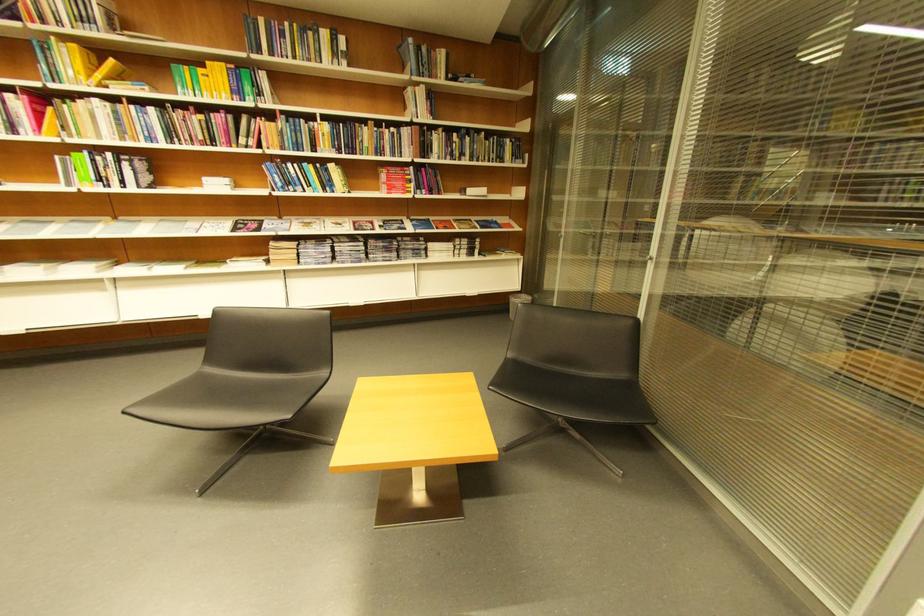
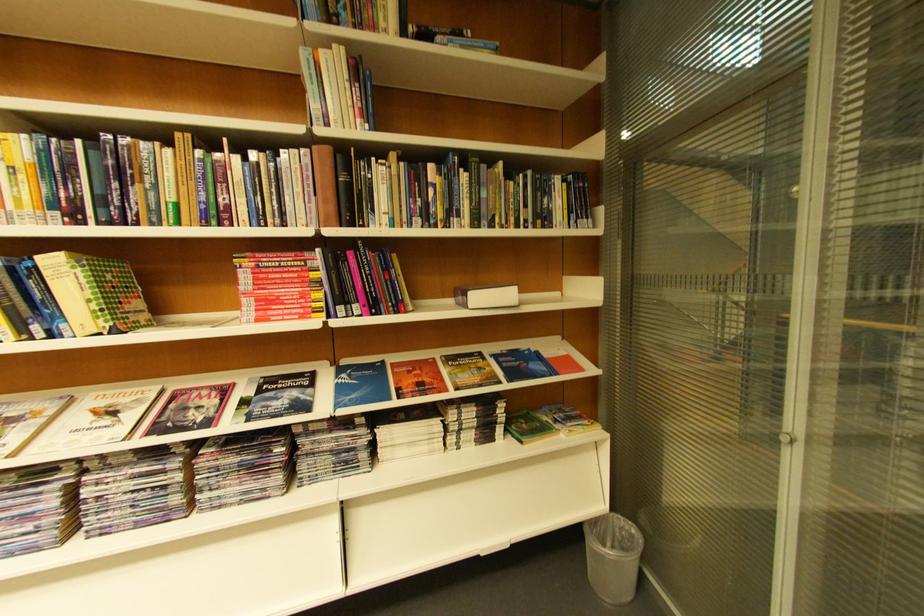
Locate, in the second image, the point that corresponds to point 512,160 in the first image.

(554, 221)